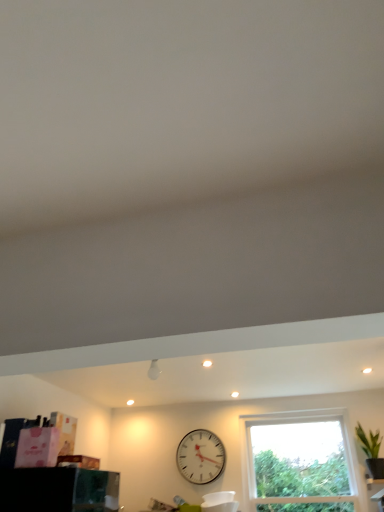
Describe the element at coordinates (369, 441) in the screenshot. This screenshot has height=512, width=384. I see `green leafy plant at right` at that location.

I want to click on matte white cabinet at lower right, so click(379, 499).

The height and width of the screenshot is (512, 384). What do you see at coordinates (200, 457) in the screenshot?
I see `white plastic wall clock at center` at bounding box center [200, 457].

At what (x,y) coordinates should I click in order to perform the action: click on green leafy plant at right. Please return your answer as a coordinate pair (x, y). Looking at the image, I should click on (369, 441).

Who is smaller, green leafy plant at right or matte white cabinet at lower right?

matte white cabinet at lower right is smaller.

Does green leafy plant at right touch matte white cabinet at lower right?

green leafy plant at right is not next to matte white cabinet at lower right, and they're not touching.

Is point (370, 441) farther from viewer compared to point (373, 496)?

Yes, it is behind point (373, 496).

Is green leafy plant at right positioned with its back to matte white cabinet at lower right?

No, green leafy plant at right's orientation is not away from matte white cabinet at lower right.

Where is `plant positioned vertically above the transparent glass window at center (from a real-world perspective)`? Image resolution: width=384 pixels, height=512 pixels. plant positioned vertically above the transparent glass window at center (from a real-world perspective) is located at coordinates (369, 441).

Considering the sizes of transparent glass window at center and green leafy plant at right in the image, is transparent glass window at center taller or shorter than green leafy plant at right?

Clearly, transparent glass window at center is taller compared to green leafy plant at right.

Does point (318, 412) come in front of point (374, 456)?

No, (318, 412) is further to viewer.

Is transparent glass window at center facing away from green leafy plant at right?

transparent glass window at center is not turned away from green leafy plant at right.

The width and height of the screenshot is (384, 512). In order to click on wall clock above the green leafy plant at right (from a real-world perspective) in this screenshot , I will do `click(200, 457)`.

Between white plastic wall clock at center and green leafy plant at right, which one is positioned behind?

white plastic wall clock at center is further away from the camera.

Considering the relative sizes of white plastic wall clock at center and green leafy plant at right in the image provided, is white plastic wall clock at center bigger than green leafy plant at right?

Yes, white plastic wall clock at center is bigger than green leafy plant at right.

Which is behind, point (381, 501) or point (360, 429)?

The point (360, 429) is farther.

Which of these two, matte white cabinet at lower right or green leafy plant at right, is bigger?

With larger size is green leafy plant at right.

Could you tell me if matte white cabinet at lower right is facing green leafy plant at right?

No, matte white cabinet at lower right is not turned towards green leafy plant at right.

From a real-world perspective, which object rests below the other?

matte white cabinet at lower right is physically lower.

Is white plastic wall clock at center far from transparent glass window at center?

white plastic wall clock at center is actually quite close to transparent glass window at center.

Is white plastic wall clock at center facing away from transparent glass window at center?

No, white plastic wall clock at center is not facing away from transparent glass window at center.

How many degrees apart are the facing directions of white plastic wall clock at center and transparent glass window at center?

There is a 0.397-degree angle between the facing directions of white plastic wall clock at center and transparent glass window at center.

Looking at this image, which of these two, white plastic wall clock at center or transparent glass window at center, is thinner?

With smaller width is white plastic wall clock at center.

Which is behind, point (322, 483) or point (382, 489)?

The point (322, 483) is behind.

Is transparent glass window at center at the right side of matte white cabinet at lower right?

No.

Relative to matte white cabinet at lower right, is transparent glass window at center in front or behind?

Clearly, transparent glass window at center is behind matte white cabinet at lower right.

In order to click on window that is above the matte white cabinet at lower right (from the image's perspective) in this screenshot , I will do `click(299, 459)`.

What's the angular difference between green leafy plant at right and transparent glass window at center's facing directions?

They differ by 0.397 degrees in their facing directions.

Is transparent glass window at center at the back of green leafy plant at right?

No, transparent glass window at center is not at the back of green leafy plant at right.

Measure the distance between green leafy plant at right and transparent glass window at center.

green leafy plant at right is 24.15 inches from transparent glass window at center.

From the image's perspective, between green leafy plant at right and transparent glass window at center, which one is located above?

From the image's view, green leafy plant at right is above.

Locate an element on the screen. furniture to the right of green leafy plant at right is located at coordinates (379, 499).

Where is `window behind the green leafy plant at right`? window behind the green leafy plant at right is located at coordinates (299, 459).

Estimate the real-world distances between objects in this image. Which object is further from matte white cabinet at lower right, white plastic wall clock at center or transparent glass window at center?

white plastic wall clock at center is positioned further to the anchor matte white cabinet at lower right.

Based on their spatial positions, is transparent glass window at center or green leafy plant at right further from matte white cabinet at lower right?

transparent glass window at center.

When comparing their distances from white plastic wall clock at center, does transparent glass window at center or green leafy plant at right seem further?

Among the two, green leafy plant at right is located further to white plastic wall clock at center.

Estimate the real-world distances between objects in this image. Which object is further from transparent glass window at center, matte white cabinet at lower right or green leafy plant at right?

matte white cabinet at lower right is positioned further to the anchor transparent glass window at center.

When comparing their distances from green leafy plant at right, does transparent glass window at center or white plastic wall clock at center seem further?

white plastic wall clock at center is positioned further to the anchor green leafy plant at right.

Based on the photo, estimate the real-world distances between objects in this image. Which object is further from green leafy plant at right, white plastic wall clock at center or transparent glass window at center?

Based on the image, white plastic wall clock at center appears to be further to green leafy plant at right.

When comparing their distances from matte white cabinet at lower right, does green leafy plant at right or transparent glass window at center seem closer?

Based on the image, green leafy plant at right appears to be nearer to matte white cabinet at lower right.

From the image, which object appears to be nearer to green leafy plant at right, white plastic wall clock at center or matte white cabinet at lower right?

matte white cabinet at lower right is closer to green leafy plant at right.

At what (x,y) coordinates should I click in order to perform the action: click on window between white plastic wall clock at center and matte white cabinet at lower right. Please return your answer as a coordinate pair (x, y). The width and height of the screenshot is (384, 512). Looking at the image, I should click on (299, 459).

Where is `plant situated between white plastic wall clock at center and matte white cabinet at lower right from left to right`? The width and height of the screenshot is (384, 512). plant situated between white plastic wall clock at center and matte white cabinet at lower right from left to right is located at coordinates (369, 441).

Where is `plant between transparent glass window at center and matte white cabinet at lower right in the horizontal direction`? plant between transparent glass window at center and matte white cabinet at lower right in the horizontal direction is located at coordinates tap(369, 441).

The height and width of the screenshot is (512, 384). I want to click on window between white plastic wall clock at center and green leafy plant at right, so click(x=299, y=459).